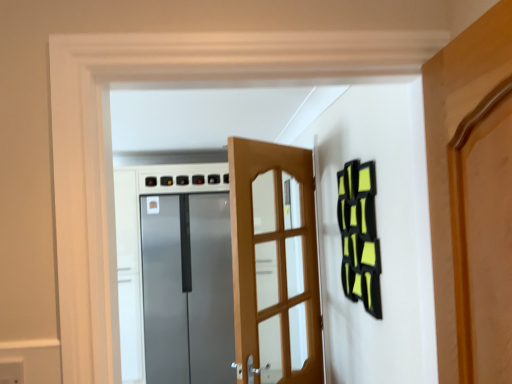
Question: Is satin metallic refrigerator at center, positioned as the first door in back-to-front order, turned away from wooden door at center, acting as the first door starting from the front?

Choices:
 (A) yes
 (B) no

Answer: (B)

Question: From the image's perspective, is satin metallic refrigerator at center, positioned as the first door in back-to-front order, located beneath wooden door at center, arranged as the second door when viewed from the back?

Choices:
 (A) no
 (B) yes

Answer: (B)

Question: Can you confirm if satin metallic refrigerator at center, placed as the 2th door when sorted from front to back, is bigger than wooden door at center, acting as the first door starting from the front?

Choices:
 (A) yes
 (B) no

Answer: (A)

Question: Is satin metallic refrigerator at center, acting as the 2th door starting from the right, at the left side of wooden door at center, arranged as the second door when viewed from the back?

Choices:
 (A) yes
 (B) no

Answer: (A)

Question: Considering the relative positions of satin metallic refrigerator at center, acting as the 2th door starting from the right, and wooden door at center, positioned as the first door in right-to-left order, in the image provided, is satin metallic refrigerator at center, acting as the 2th door starting from the right, to the right of wooden door at center, positioned as the first door in right-to-left order, from the viewer's perspective?

Choices:
 (A) no
 (B) yes

Answer: (A)

Question: From a real-world perspective, is satin metallic refrigerator at center, placed as the 2th door when sorted from front to back, positioned above or below matte gray electric outlet at lower left?

Choices:
 (A) below
 (B) above

Answer: (A)

Question: Does point (224, 284) appear closer or farther from the camera than point (12, 380)?

Choices:
 (A) closer
 (B) farther

Answer: (B)

Question: Is satin metallic refrigerator at center, acting as the 2th door starting from the right, taller or shorter than matte gray electric outlet at lower left?

Choices:
 (A) short
 (B) tall

Answer: (B)

Question: Would you say satin metallic refrigerator at center, acting as the 2th door starting from the right, is to the left or to the right of matte gray electric outlet at lower left in the picture?

Choices:
 (A) left
 (B) right

Answer: (A)

Question: Considering their positions, is wooden door at center, arranged as the second door when viewed from the back, located in front of or behind satin metallic refrigerator at center, positioned as the first door in back-to-front order?

Choices:
 (A) behind
 (B) front

Answer: (B)

Question: From a real-world perspective, is wooden door at center, acting as the first door starting from the front, above or below satin metallic refrigerator at center, placed as the 2th door when sorted from front to back?

Choices:
 (A) above
 (B) below

Answer: (A)

Question: Based on their sizes in the image, would you say wooden door at center, positioned as the first door in right-to-left order, is bigger or smaller than satin metallic refrigerator at center, placed as the 2th door when sorted from front to back?

Choices:
 (A) small
 (B) big

Answer: (A)

Question: Choose the correct answer: Is wooden door at center, arranged as the second door when viewed from the back, inside satin metallic refrigerator at center, positioned as the first door in back-to-front order, or outside it?

Choices:
 (A) inside
 (B) outside

Answer: (B)

Question: Looking at their shapes, would you say wooden door at center, the second door from the left, is wider or thinner than matte gray electric outlet at lower left?

Choices:
 (A) thin
 (B) wide

Answer: (B)

Question: From the image's perspective, is wooden door at center, arranged as the second door when viewed from the back, located above or below matte gray electric outlet at lower left?

Choices:
 (A) above
 (B) below

Answer: (B)